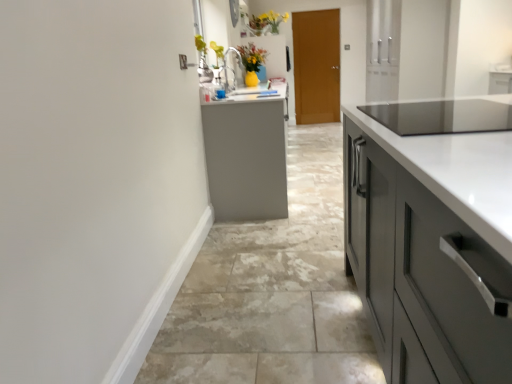
This screenshot has width=512, height=384. What do you see at coordinates (316, 66) in the screenshot?
I see `brown wooden door at center` at bounding box center [316, 66].

This screenshot has height=384, width=512. What do you see at coordinates (266, 22) in the screenshot? I see `yellow matte vase at upper center` at bounding box center [266, 22].

What do you see at coordinates (273, 291) in the screenshot?
I see `gray tile floor at center` at bounding box center [273, 291].

Where is `brown wooden door at center`? brown wooden door at center is located at coordinates (316, 66).

Is yellow matte vase at upper center positioned with its back to brown wooden door at center?

No, yellow matte vase at upper center's orientation is not away from brown wooden door at center.

Is there a large distance between yellow matte vase at upper center and brown wooden door at center?

No, there isn't a large distance between yellow matte vase at upper center and brown wooden door at center.

Looking at their sizes, would you say yellow matte vase at upper center is wider or thinner than brown wooden door at center?

Considering their sizes, yellow matte vase at upper center looks broader than brown wooden door at center.

Considering the positions of objects yellow matte vase at upper center and brown wooden door at center in the image provided, who is more to the left, yellow matte vase at upper center or brown wooden door at center?

From the viewer's perspective, yellow matte vase at upper center appears more on the left side.

Can you confirm if brown wooden door at center is positioned to the right of yellow matte vase at upper center?

Correct, you'll find brown wooden door at center to the right of yellow matte vase at upper center.

What's the angular difference between brown wooden door at center and yellow matte vase at upper center's facing directions?

The angle between the facing direction of brown wooden door at center and the facing direction of yellow matte vase at upper center is 91.2 degrees.

Considering the sizes of brown wooden door at center and yellow matte vase at upper center in the image, is brown wooden door at center taller or shorter than yellow matte vase at upper center?

In the image, brown wooden door at center appears to be taller than yellow matte vase at upper center.

Considering the positions of objects brown wooden door at center and yellow matte vase at upper center in the image provided, who is behind, brown wooden door at center or yellow matte vase at upper center?

brown wooden door at center is behind.

Can you confirm if yellow matte vase at upper center is shorter than gray tile floor at center?

No, yellow matte vase at upper center is not shorter than gray tile floor at center.

Which point is more forward, (277, 21) or (232, 340)?

Point (232, 340)

From the image's perspective, which is above, yellow matte vase at upper center or gray tile floor at center?

yellow matte vase at upper center, from the image's perspective.

Is yellow matte vase at upper center inside or outside of gray tile floor at center?

yellow matte vase at upper center cannot be found inside gray tile floor at center.

Would you consider brown wooden door at center to be distant from gray tile floor at center?

Indeed, brown wooden door at center is not near gray tile floor at center.

Which object is positioned more to the right, brown wooden door at center or gray tile floor at center?

Positioned to the right is gray tile floor at center.

Which is closer to the camera, (339, 68) or (210, 279)?

The point (210, 279) is in front.

Where is `concrete below the brown wooden door at center (from the image's perspective)`? The width and height of the screenshot is (512, 384). concrete below the brown wooden door at center (from the image's perspective) is located at coordinates (273, 291).

Which is more to the left, gray tile floor at center or yellow matte vase at upper center?

yellow matte vase at upper center is more to the left.

Is yellow matte vase at upper center completely or partially inside gray tile floor at center?

Definitely not — yellow matte vase at upper center is not inside gray tile floor at center.

Are gray tile floor at center and yellow matte vase at upper center located far from each other?

gray tile floor at center is far away from yellow matte vase at upper center.

The height and width of the screenshot is (384, 512). Identify the location of concrete that is on the right side of yellow matte vase at upper center. (273, 291).

Based on the photo, considering the sizes of objects gray tile floor at center and brown wooden door at center in the image provided, who is thinner, gray tile floor at center or brown wooden door at center?

brown wooden door at center is thinner.

Who is shorter, gray tile floor at center or brown wooden door at center?

gray tile floor at center.

What's the angular difference between gray tile floor at center and brown wooden door at center's facing directions?

gray tile floor at center and brown wooden door at center are facing 1.22 degrees away from each other.

Is gray tile floor at center aimed at brown wooden door at center?

No, gray tile floor at center does not turn towards brown wooden door at center.

Identify the location of door below the yellow matte vase at upper center (from a real-world perspective). The image size is (512, 384). (316, 66).

At what (x,y) coordinates should I click in order to perform the action: click on door below the yellow matte vase at upper center (from the image's perspective). Please return your answer as a coordinate pair (x, y). The width and height of the screenshot is (512, 384). Looking at the image, I should click on (316, 66).

Which object lies nearer to the anchor point gray tile floor at center, brown wooden door at center or yellow matte vase at upper center?

brown wooden door at center lies closer to gray tile floor at center than the other object.

Looking at the image, which one is located further to yellow matte vase at upper center, brown wooden door at center or gray tile floor at center?

The object further to yellow matte vase at upper center is gray tile floor at center.

In the scene shown: Which object lies nearer to the anchor point brown wooden door at center, yellow matte vase at upper center or gray tile floor at center?

yellow matte vase at upper center.

Looking at the image, which one is located closer to yellow matte vase at upper center, gray tile floor at center or brown wooden door at center?

The object closer to yellow matte vase at upper center is brown wooden door at center.

Looking at the image, which one is located closer to gray tile floor at center, yellow matte vase at upper center or brown wooden door at center?

brown wooden door at center is closer to gray tile floor at center.

Which object lies nearer to the anchor point brown wooden door at center, gray tile floor at center or yellow matte vase at upper center?

yellow matte vase at upper center.

Find the location of `floral arrangement between gray tile floor at center and brown wooden door at center from front to back`. floral arrangement between gray tile floor at center and brown wooden door at center from front to back is located at coordinates (266, 22).